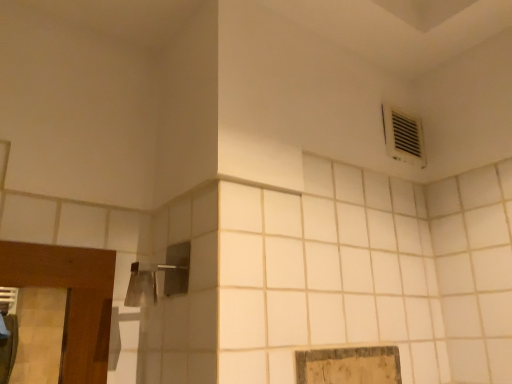
Question: Is brushed metal shower head at upper left in front of or behind white plastic air conditioning at upper right in the image?

Choices:
 (A) front
 (B) behind

Answer: (A)

Question: Is brushed metal shower head at upper left bigger or smaller than white plastic air conditioning at upper right?

Choices:
 (A) big
 (B) small

Answer: (A)

Question: In terms of width, does brushed metal shower head at upper left look wider or thinner when compared to white plastic air conditioning at upper right?

Choices:
 (A) wide
 (B) thin

Answer: (A)

Question: Is white plastic air conditioning at upper right taller or shorter than brushed metal shower head at upper left?

Choices:
 (A) short
 (B) tall

Answer: (B)

Question: From a real-world perspective, is white plastic air conditioning at upper right above or below brushed metal shower head at upper left?

Choices:
 (A) above
 (B) below

Answer: (A)

Question: Do you think white plastic air conditioning at upper right is within brushed metal shower head at upper left, or outside of it?

Choices:
 (A) inside
 (B) outside

Answer: (B)

Question: Visually, is white plastic air conditioning at upper right positioned to the left or to the right of brushed metal shower head at upper left?

Choices:
 (A) right
 (B) left

Answer: (A)